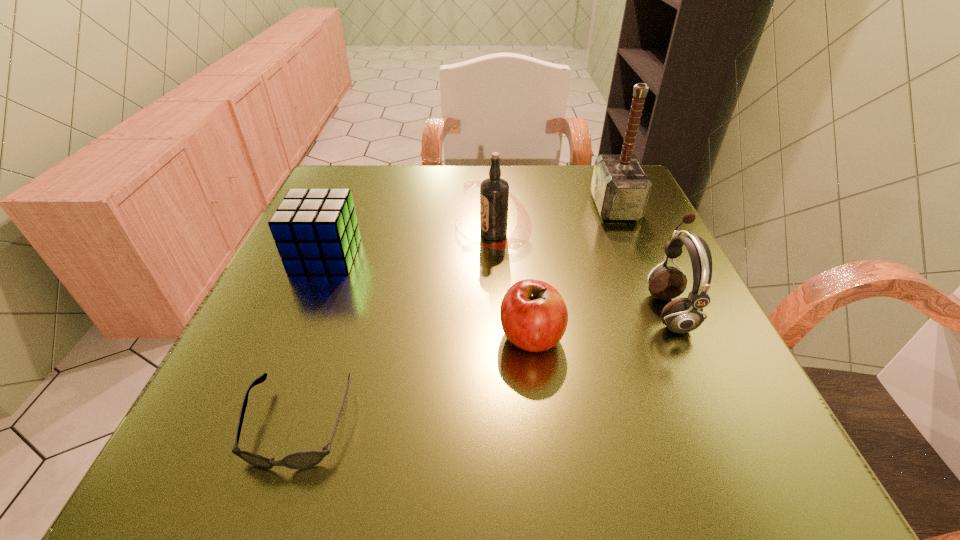
Locate an element on the screen. The image size is (960, 540). sunglasses that is at the left edge is located at coordinates (306, 459).

You are a GUI agent. You are given a task and a screenshot of the screen. Output one action in this format:
    pyautogui.click(x=<x>, y=<y>)
    Task: Click on the hammer positioned at the right edge
    This screenshot has width=960, height=540.
    Given the screenshot: What is the action you would take?
    pyautogui.click(x=620, y=187)

Locate an element on the screen. Image resolution: width=960 pixels, height=540 pixels. earphone located at the right edge is located at coordinates (682, 315).

Locate an element on the screen. Image resolution: width=960 pixels, height=540 pixels. object that is at the near left corner is located at coordinates (306, 459).

At what (x,y) coordinates should I click in order to perform the action: click on object present at the far right corner. Please return your answer as a coordinate pair (x, y). This screenshot has width=960, height=540. Looking at the image, I should click on (620, 187).

Find the location of a particular element. free region at the far edge of the desktop is located at coordinates (521, 185).

In order to click on vacant space at the near edge in this screenshot , I will do `click(531, 433)`.

Image resolution: width=960 pixels, height=540 pixels. In order to click on free space at the left edge of the desktop in this screenshot , I will do `click(267, 338)`.

At what (x,y) coordinates should I click in order to perform the action: click on blank space at the right edge of the desktop. Please return your answer as a coordinate pair (x, y). The height and width of the screenshot is (540, 960). Looking at the image, I should click on (626, 289).

In the image, there is a desktop. Identify the location of free space at the far left corner. coord(377,183).